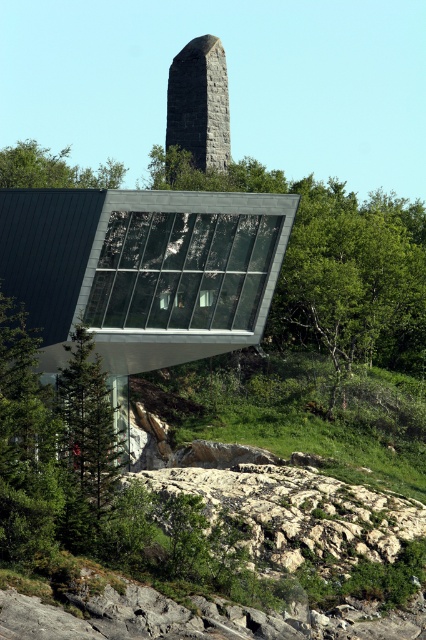
You are standing at the base of the granite stone obelisk at upper center and want to walk towards the green leafy tree at upper left. Which direction should you move?

You should move to the left because the green leafy tree at upper left is to the left of the granite stone obelisk at upper center.

You are an architect designing a new sculpture garden. You want to place a new sculpture that is the same size as the granite stone obelisk at upper center between these two objects. Will it fit in terms of size compared to the green leafy tree at upper left?

The granite stone obelisk at upper center is smaller than the green leafy tree at upper left. Therefore, a sculpture the same size as the granite stone obelisk at upper center would also be smaller than the tree, so it would fit in terms of size compared to the green leafy tree at upper left.